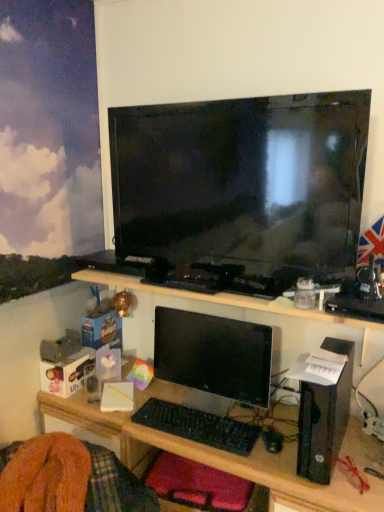
Locate an element on the screen. free point above black plastic keyboard at center (from a real-world perspective) is located at coordinates (198, 418).